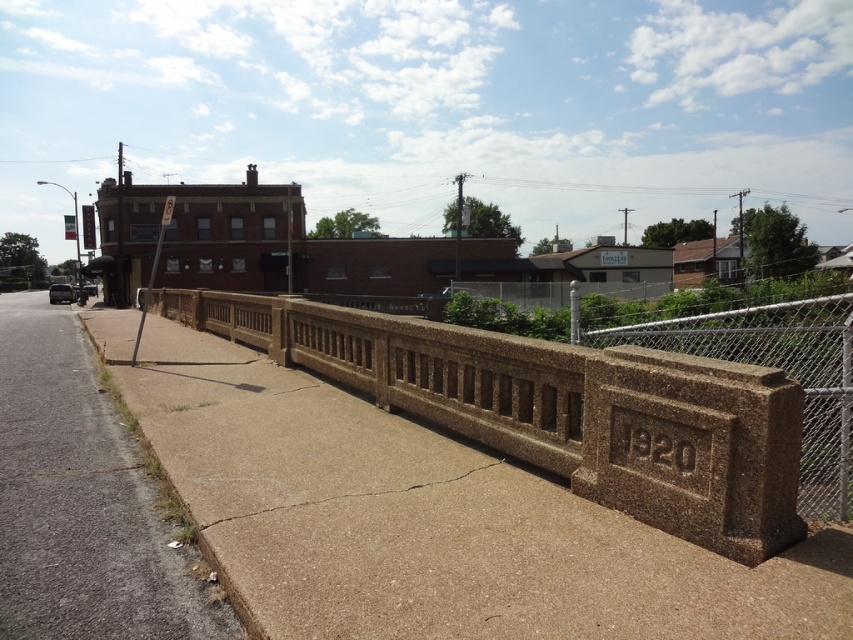
Does brown textured concrete at center have a smaller size compared to gray concrete sidewalk at lower left?

Yes, brown textured concrete at center is smaller than gray concrete sidewalk at lower left.

Is brown textured concrete at center further to camera compared to gray concrete sidewalk at lower left?

That is True.

This screenshot has height=640, width=853. What do you see at coordinates (560, 410) in the screenshot?
I see `brown textured concrete at center` at bounding box center [560, 410].

Find the location of a particular element. This screenshot has width=853, height=640. brown textured concrete at center is located at coordinates (560, 410).